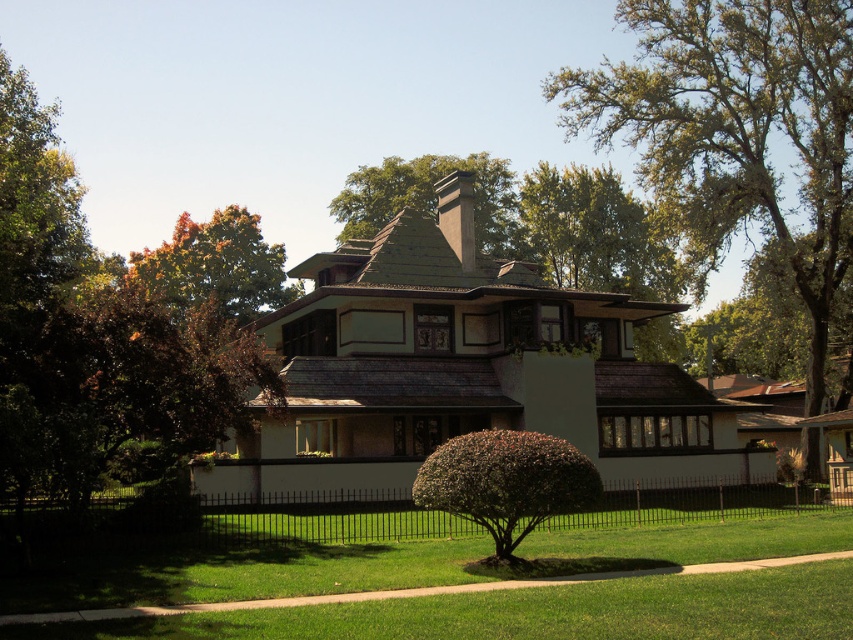
Question: Where is brown leafy tree at upper left located in relation to green leafy tree at upper right in the image?

Choices:
 (A) below
 (B) above

Answer: (A)

Question: Does black wrought iron fence at center come behind green leafy tree at upper center?

Choices:
 (A) yes
 (B) no

Answer: (B)

Question: In this image, where is black wrought iron fence at center located relative to brown textured tree at upper center?

Choices:
 (A) above
 (B) below

Answer: (B)

Question: Which of the following is the farthest from the observer?

Choices:
 (A) black wrought iron fence at center
 (B) brown textured bush at center

Answer: (A)

Question: Which object is the closest to the green leafy tree at upper center?

Choices:
 (A) brown leafy tree at upper left
 (B) black wrought iron fence at center

Answer: (A)

Question: Which object is closer to the camera taking this photo?

Choices:
 (A) green leafy tree at upper right
 (B) green leafy tree at upper center
 (C) black wrought iron fence at center
 (D) brown textured tree at upper center

Answer: (C)